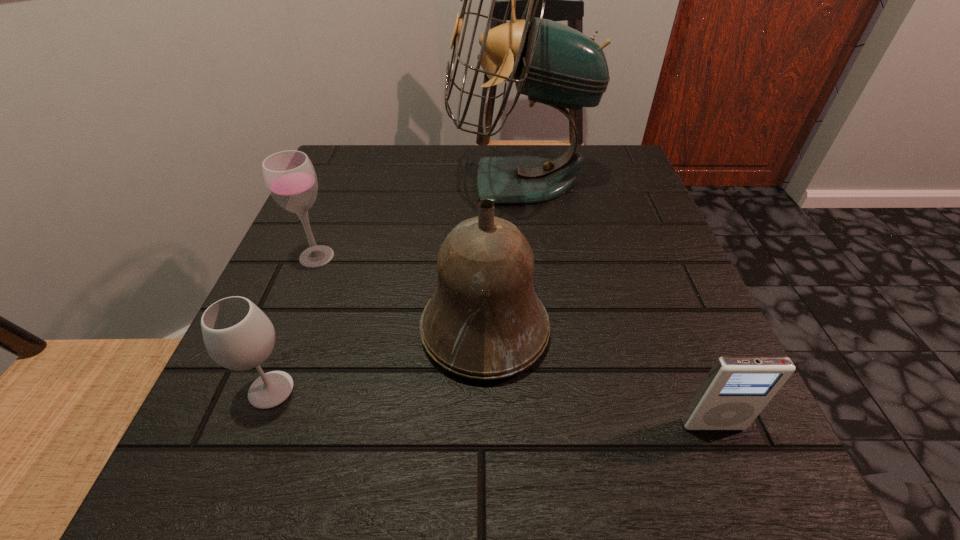
At what (x,y) coordinates should I click in order to perform the action: click on vacant space located 0.060m on the front-facing side of the tallest object for air flow. Please return your answer as a coordinate pair (x, y). Image resolution: width=960 pixels, height=540 pixels. Looking at the image, I should click on (421, 181).

I want to click on free space located 0.110m on the front of the fourth shortest object, so click(486, 467).

This screenshot has height=540, width=960. In order to click on vacant space situated on the right of the second farthest object in this screenshot , I will do coord(465,256).

Locate an element on the screen. The width and height of the screenshot is (960, 540). vacant point located on the back of the shorter wineglass is located at coordinates (x=338, y=217).

This screenshot has height=540, width=960. I want to click on object present at the far edge, so click(x=553, y=64).

This screenshot has width=960, height=540. Find the location of `fan situated at the right edge`. fan situated at the right edge is located at coordinates (553, 64).

You are a GUI agent. You are given a task and a screenshot of the screen. Output one action in this format:
    pyautogui.click(x=<x>, y=<y>)
    Task: Click on the iPod that is at the right edge
    This screenshot has width=960, height=540.
    Given the screenshot: What is the action you would take?
    pyautogui.click(x=737, y=388)

Locate an element on the screen. The image size is (960, 540). object that is at the far right corner is located at coordinates (553, 64).

At what (x,y) coordinates should I click in order to perform the action: click on vacant space at the far edge of the desktop. Please return your answer as a coordinate pair (x, y). This screenshot has height=540, width=960. Looking at the image, I should click on (419, 168).

Find the location of a particular element. The height and width of the screenshot is (540, 960). vacant space at the near edge is located at coordinates (441, 465).